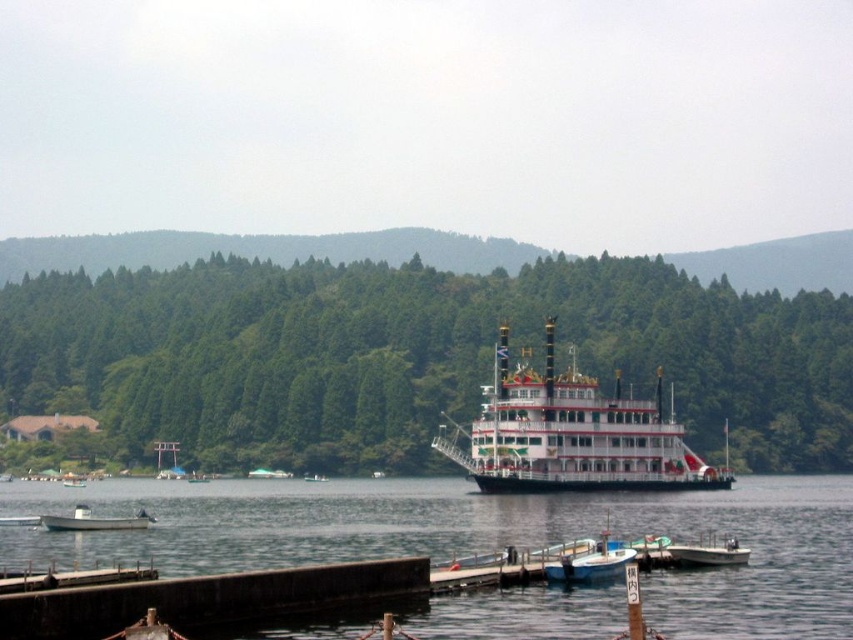
You are standing on the wooden dock and want to reach the point marked at coordinates (194, 628). Given that the dock is 40 meters long, can you safely walk to that point without stepping into the water?

The point marked at coordinates (194, 628) is 50.82 meters away from the viewer, which is beyond the dock length of 40 meters. Therefore, you cannot safely walk to that point without stepping into the water.

You are standing at the point marked as point (x=572, y=433) in the image. What is the nearest object to you?

The nearest object to you is the white wooden paddle steamer at center, which is located exactly at the point (x=572, y=433).

You are a tourist standing on the dark gray concrete dock at lower left and want to board the white wooden paddle steamer at center. Which direction should you walk to reach the boat?

The white wooden paddle steamer at center is positioned over dark gray concrete dock at lower left, so you should walk forward towards the boat since it is directly ahead of you on the dock.